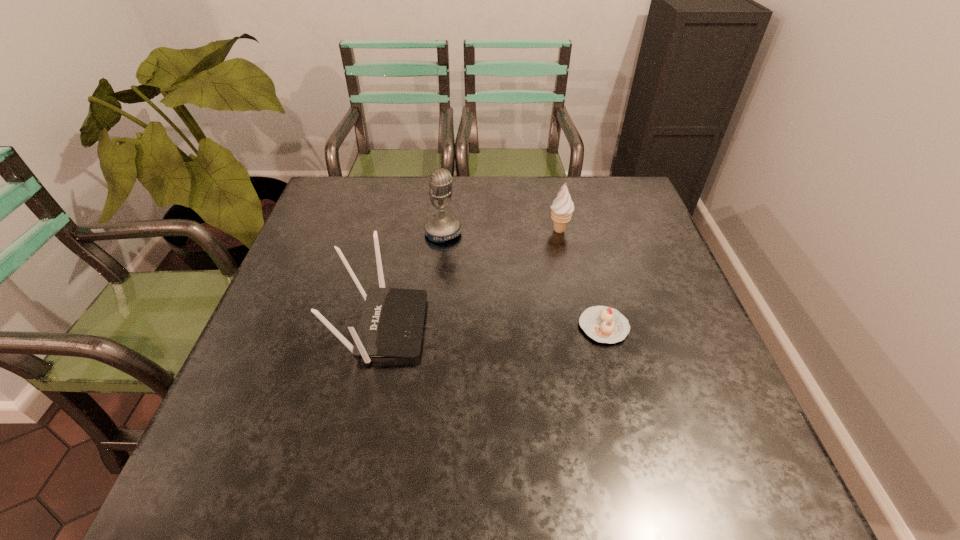
The image size is (960, 540). What are the coordinates of `router` in the screenshot? It's located at (392, 322).

Image resolution: width=960 pixels, height=540 pixels. In order to click on cupcake in this screenshot , I will do `click(603, 324)`.

Locate an element on the screen. This screenshot has height=540, width=960. microphone is located at coordinates (440, 228).

You are a GUI agent. You are given a task and a screenshot of the screen. Output one action in this format:
    pyautogui.click(x=<x>, y=<y>)
    Task: Click on the icecream
    The height and width of the screenshot is (540, 960).
    Given the screenshot: What is the action you would take?
    pyautogui.click(x=562, y=208)

Identify the location of vacant space located on the front-facing side of the router. (491, 327).

Where is `vacant space situated on the left of the cupcake`? vacant space situated on the left of the cupcake is located at coordinates (403, 327).

Identify the location of vacant space situated 0.380m on the front-facing side of the tallest object. Image resolution: width=960 pixels, height=540 pixels. (533, 336).

Locate an element on the screen. The height and width of the screenshot is (540, 960). free space located 0.390m on the front-facing side of the tallest object is located at coordinates (536, 339).

Where is `free space located on the front-facing side of the tallest object`? This screenshot has height=540, width=960. free space located on the front-facing side of the tallest object is located at coordinates (523, 324).

Locate an element on the screen. The height and width of the screenshot is (540, 960). free region located 0.350m on the front-facing side of the icecream is located at coordinates pyautogui.click(x=496, y=319).